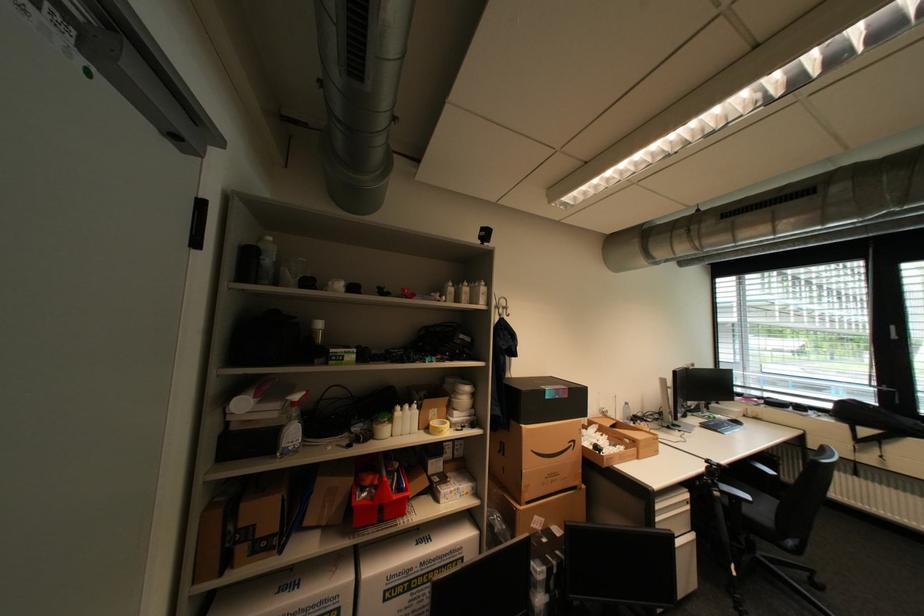
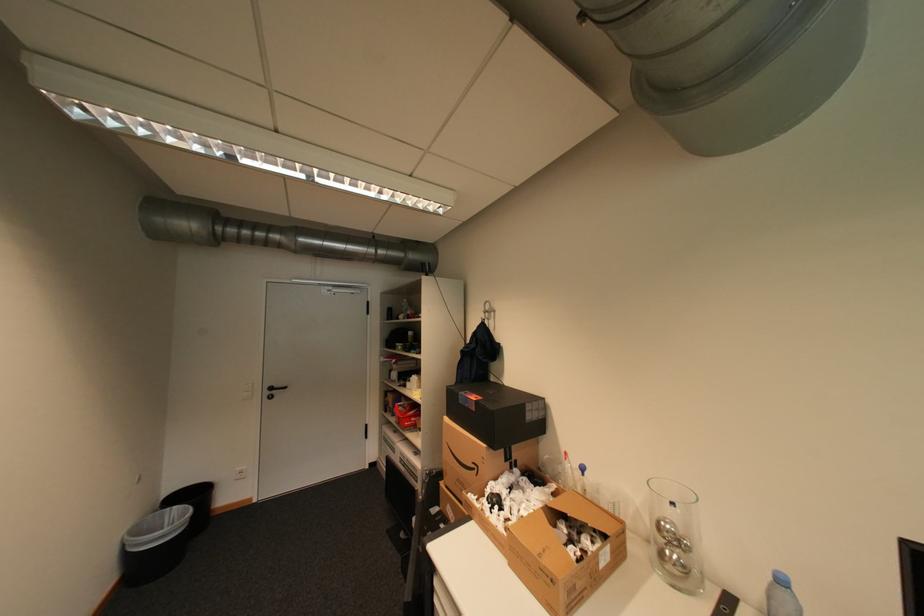
Locate, in the second image, the point that corresponds to [288,553] in the first image.

(400, 416)